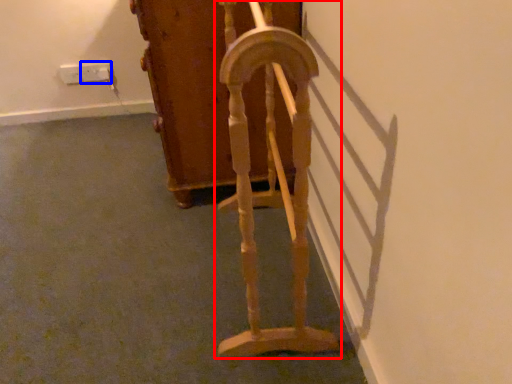
Question: Which object appears farthest to the camera in this image, furniture (highlighted by a red box) or electric outlet (highlighted by a blue box)?

Choices:
 (A) furniture
 (B) electric outlet

Answer: (B)